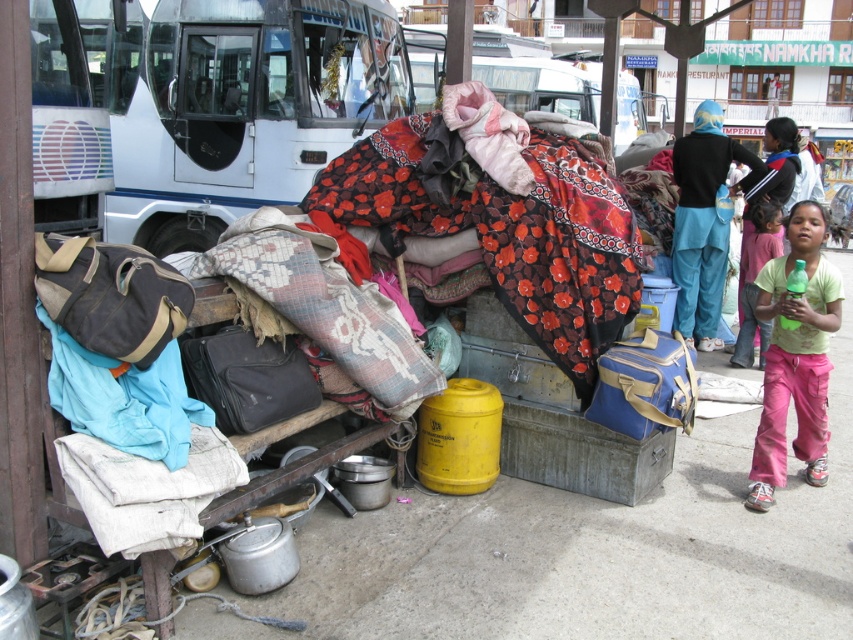
Question: Does white glossy bus at upper left appear on the left side of green cotton shirt at lower right?

Choices:
 (A) yes
 (B) no

Answer: (A)

Question: Among these points, which one is farthest from the camera?

Choices:
 (A) (354, 56)
 (B) (746, 257)

Answer: (A)

Question: Which object appears farthest from the camera in this image?

Choices:
 (A) brown canvas duffel at left
 (B) blue fabric bag at lower right
 (C) white glossy bus at upper left

Answer: (C)

Question: Does white glossy bus at upper left have a greater width compared to floral-patterned fabric at center?

Choices:
 (A) no
 (B) yes

Answer: (B)

Question: Which point is farther from the camera taking this photo?

Choices:
 (A) (85, 273)
 (B) (645, 406)

Answer: (B)

Question: Can you confirm if white plastic bus at upper left is positioned below blue fabric bag at lower right?

Choices:
 (A) no
 (B) yes

Answer: (A)